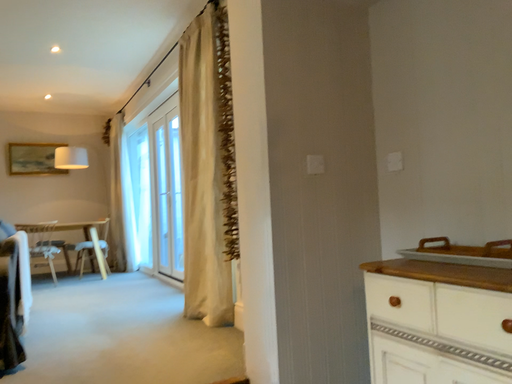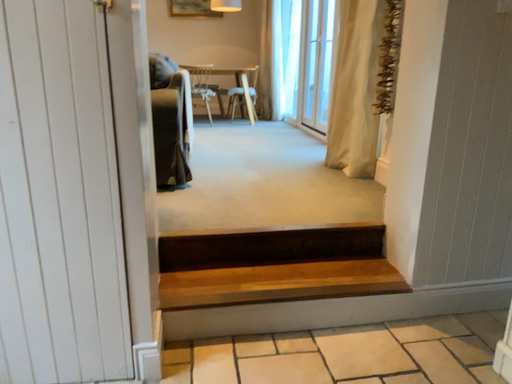
Question: Which way did the camera rotate in the video?

Choices:
 (A) rotated upward
 (B) rotated downward

Answer: (B)